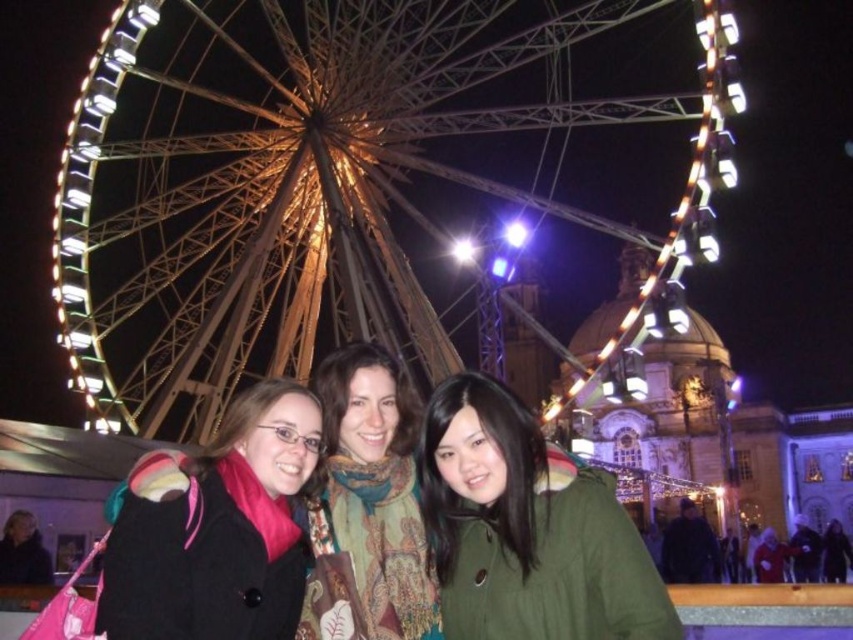
You are a photographer trying to capture a closeup of the matte black coat at center and the green textured scarf at center. Which object should you zoom in on more to ensure both are in focus?

The matte black coat at center is bigger than the green textured scarf at center, so you should zoom in more on the matte black coat at center to ensure both are in focus.

You are a photographer trying to capture a photo of the metallic ferris wheel at upper center and the matte black coat at center. Since you want to focus on the ferris wheel, which object should you zoom in on more?

The metallic ferris wheel at upper center has a larger width than the matte black coat at center, so you should zoom in more on the metallic ferris wheel at upper center to focus on it.

You are standing at the base of the metallic ferris wheel at upper center and want to toss a small ball to the matte black coat at center. The ball can travel 50 meters. Will it reach them?

The metallic ferris wheel at upper center is 49.93 meters away from the matte black coat at center. Since the ball can travel 50 meters, it will just barely reach them.